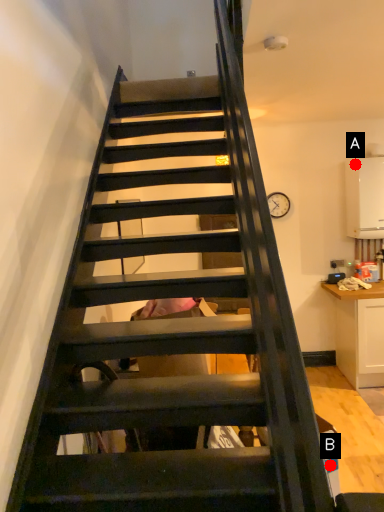
Question: Two points are circled on the image, labeled by A and B beside each circle. Which point appears farthest from the camera in this image?

Choices:
 (A) A is further
 (B) B is further

Answer: (A)